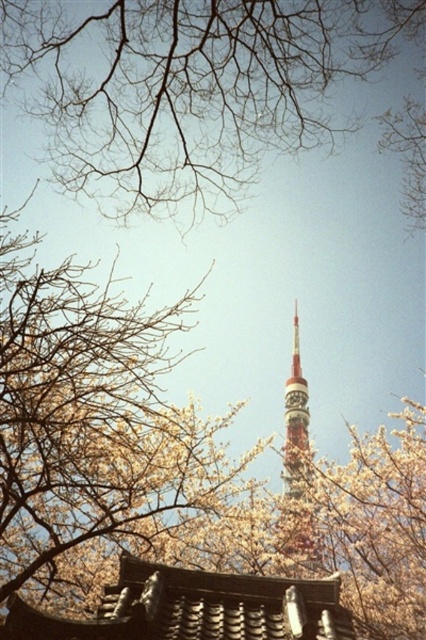
Question: Is bare branches at upper center bigger than shiny metallic tower at center?

Choices:
 (A) yes
 (B) no

Answer: (B)

Question: Which point is closer to the camera?

Choices:
 (A) fluffy white blossoms at center
 (B) bare branches at upper center
 (C) shiny metallic tower at center

Answer: (B)

Question: Which point is farther to the camera?

Choices:
 (A) (307, 556)
 (B) (118, 436)

Answer: (A)

Question: Does fluffy white blossoms at center come in front of shiny metallic tower at center?

Choices:
 (A) yes
 (B) no

Answer: (A)

Question: Which of the following is the farthest from the observer?

Choices:
 (A) shiny metallic tower at center
 (B) fluffy white blossoms at center
 (C) bare branches at upper center

Answer: (A)

Question: Is fluffy white blossoms at center to the left of shiny metallic tower at center from the viewer's perspective?

Choices:
 (A) yes
 (B) no

Answer: (A)